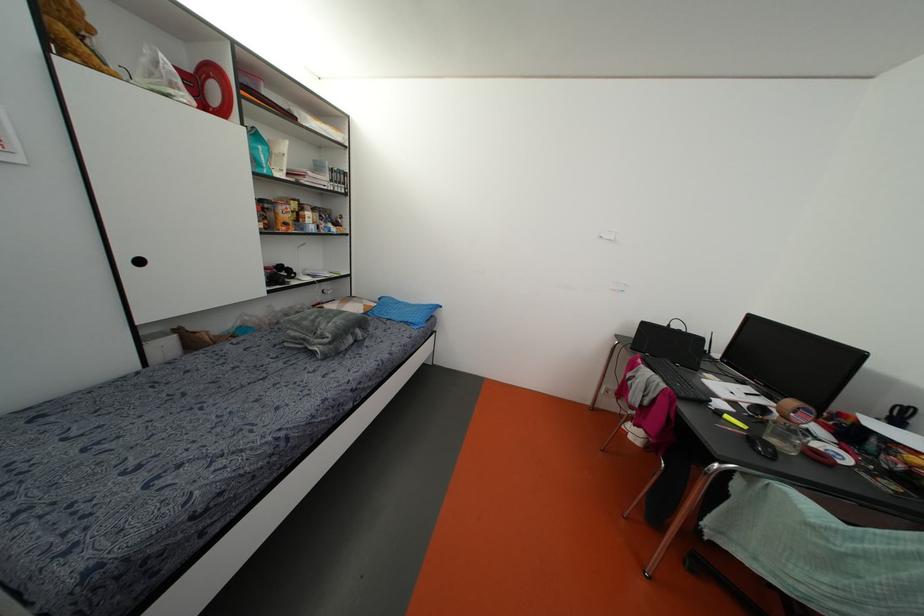
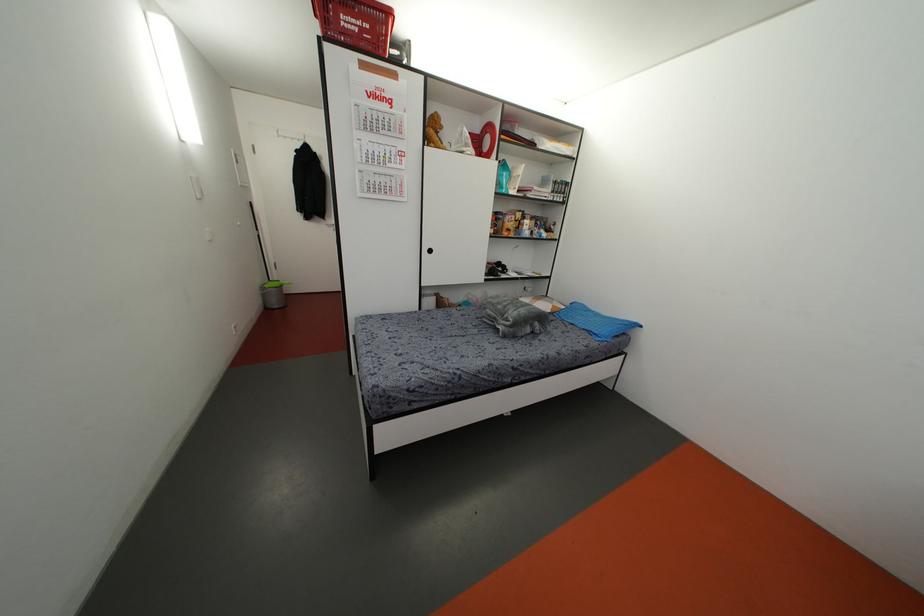
Where in the second image is the point corresponding to the point at 411,321 from the first image?

(596, 331)